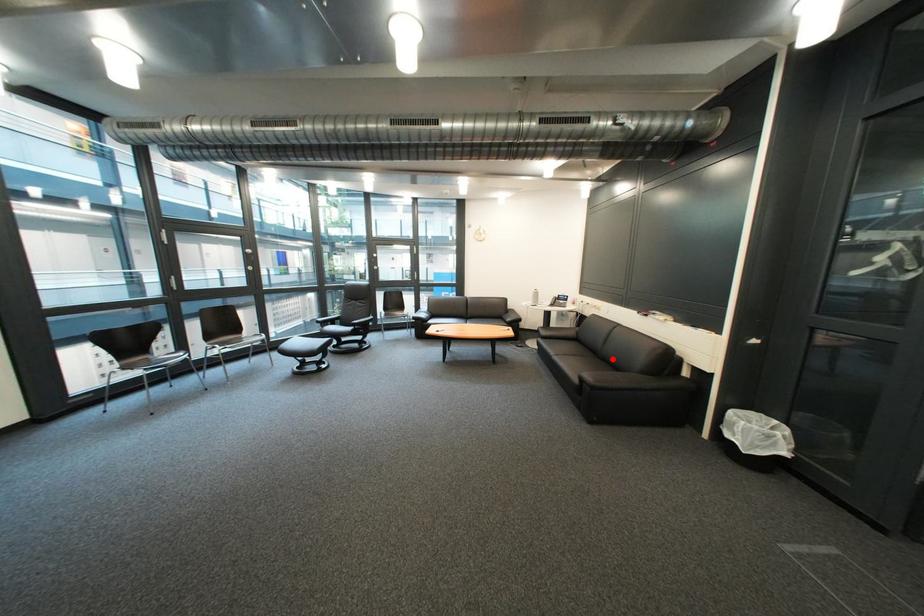
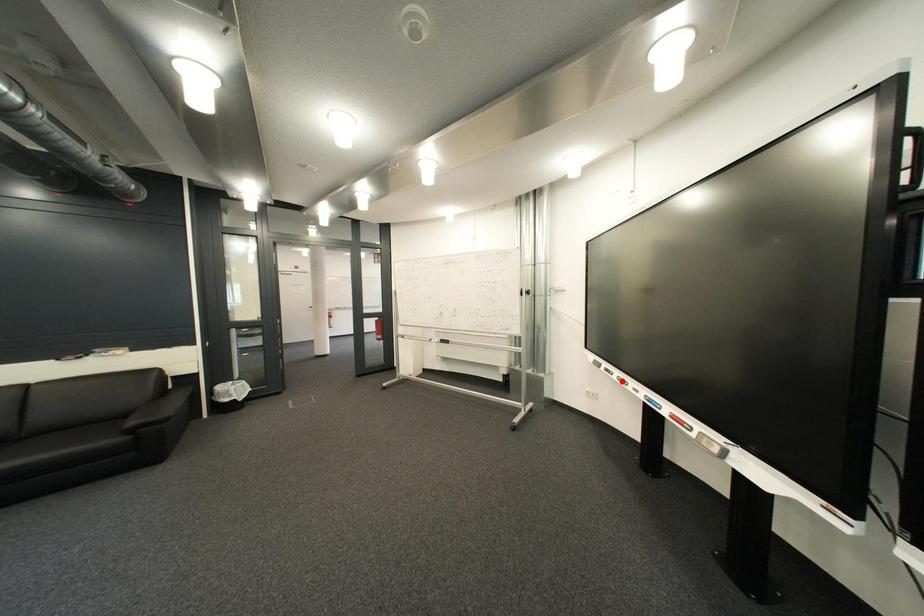
I am providing you with two images of the same scene from different viewpoints. A red point is marked on the first image and another point is marked on the second image. Is the marked point in image1 the same physical position as the marked point in image2?

No